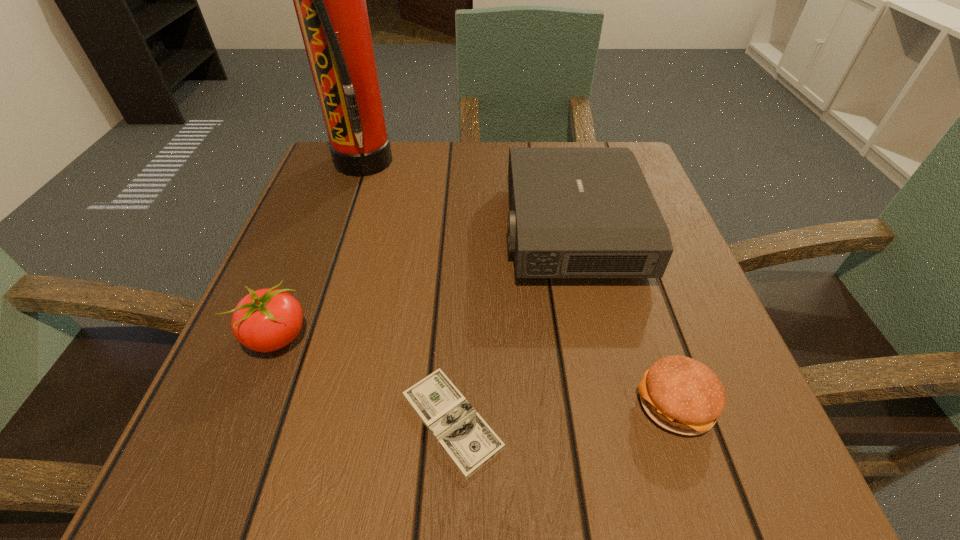
Identify which object is the fourth nearest to the fire extinguisher. Please provide its 2D coordinates. Your answer should be formatted as a tuple, i.e. [(x, y)], where the tuple contains the x and y coordinates of a point satisfying the conditions above.

[(680, 394)]

Locate which object is the third closest to the hamburger. Please provide its 2D coordinates. Your answer should be formatted as a tuple, i.e. [(x, y)], where the tuple contains the x and y coordinates of a point satisfying the conditions above.

[(265, 320)]

Locate an element on the screen. free region that satisfies the following two spatial constraints: 1. on the front-facing side of the second shortest object; 2. on the left side of the projector is located at coordinates (609, 403).

Find the location of `free space that satisfies the following two spatial constraints: 1. on the back side of the hamburger; 2. on the right side of the third object from left to right`. free space that satisfies the following two spatial constraints: 1. on the back side of the hamburger; 2. on the right side of the third object from left to right is located at coordinates point(453,403).

At what (x,y) coordinates should I click in order to perform the action: click on vacant area in the image that satisfies the following two spatial constraints: 1. with the nozzle pointing from the back of the third object from right to left; 2. on the left side of the fire extinguisher. Please return your answer as a coordinate pair (x, y). Looking at the image, I should click on (273, 421).

The image size is (960, 540). I want to click on vacant position in the image that satisfies the following two spatial constraints: 1. with the nozzle pointing from the back of the hamburger; 2. on the right side of the fire extinguisher, so click(x=279, y=403).